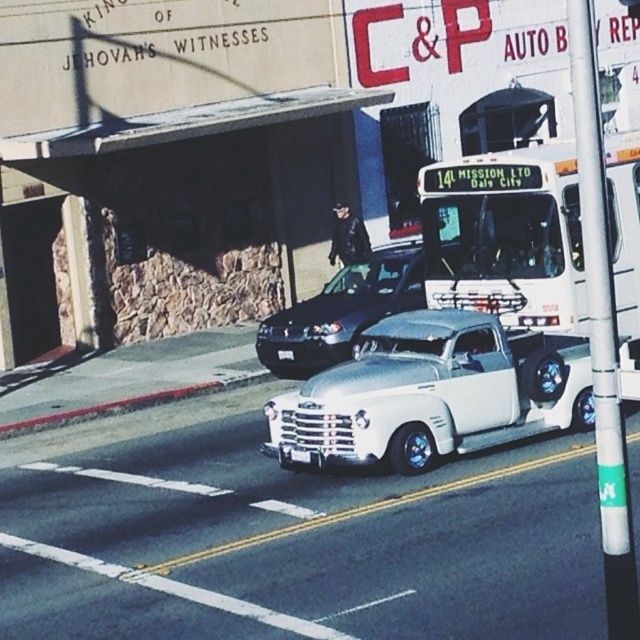
Question: Can you confirm if white matte bus at upper center is smaller than shiny black sedan at center?

Choices:
 (A) no
 (B) yes

Answer: (B)

Question: Does white metallic truck at center have a lesser width compared to shiny black sedan at center?

Choices:
 (A) yes
 (B) no

Answer: (B)

Question: Among these objects, which one is nearest to the camera?

Choices:
 (A) white metallic truck at center
 (B) shiny black sedan at center
 (C) white matte bus at upper center

Answer: (A)

Question: Does white metallic truck at center have a lesser width compared to shiny black sedan at center?

Choices:
 (A) yes
 (B) no

Answer: (B)

Question: Estimate the real-world distances between objects in this image. Which object is closer to the white matte bus at upper center?

Choices:
 (A) white metallic truck at center
 (B) shiny black sedan at center

Answer: (A)

Question: Which point appears farthest from the camera in this image?

Choices:
 (A) (497, 289)
 (B) (392, 273)

Answer: (B)